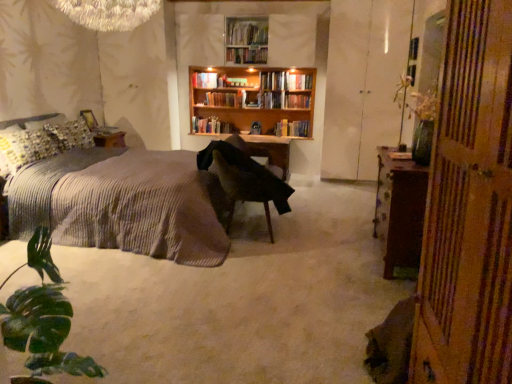
Question: Is hardcover book at center, acting as the 3th book starting from the bottom, smaller than hardcover books at center, the fifth book when ordered from top to bottom?

Choices:
 (A) no
 (B) yes

Answer: (B)

Question: From a real-world perspective, does hardcover book at center, acting as the 3th book starting from the bottom, sit lower than hardcover books at center, the fifth book when ordered from top to bottom?

Choices:
 (A) yes
 (B) no

Answer: (B)

Question: Considering the relative sizes of hardcover book at center, arranged as the 3th book when viewed from the top, and hardcover books at center, the 1th book when ordered from bottom to top, in the image provided, is hardcover book at center, arranged as the 3th book when viewed from the top, wider than hardcover books at center, the 1th book when ordered from bottom to top,?

Choices:
 (A) no
 (B) yes

Answer: (A)

Question: Considering the relative sizes of hardcover book at center, acting as the 3th book starting from the bottom, and hardcover books at center, the fifth book when ordered from top to bottom, in the image provided, is hardcover book at center, acting as the 3th book starting from the bottom, shorter than hardcover books at center, the fifth book when ordered from top to bottom,?

Choices:
 (A) yes
 (B) no

Answer: (A)

Question: Can you confirm if hardcover book at center, acting as the 3th book starting from the bottom, is bigger than hardcover books at center, the fifth book when ordered from top to bottom?

Choices:
 (A) yes
 (B) no

Answer: (B)

Question: Is hardcover book at center, acting as the 3th book starting from the bottom, far from hardcover books at center, the fifth book when ordered from top to bottom?

Choices:
 (A) no
 (B) yes

Answer: (B)

Question: Is white glossy cabinet at right positioned beyond the bounds of brown wooden cabinet at right?

Choices:
 (A) yes
 (B) no

Answer: (A)

Question: From a real-world perspective, is white glossy cabinet at right physically below brown wooden cabinet at right?

Choices:
 (A) no
 (B) yes

Answer: (A)

Question: Is white glossy cabinet at right positioned in front of brown wooden cabinet at right?

Choices:
 (A) no
 (B) yes

Answer: (A)

Question: Could you tell me if white glossy cabinet at right is facing brown wooden cabinet at right?

Choices:
 (A) yes
 (B) no

Answer: (A)

Question: Does white glossy cabinet at right appear on the left side of brown wooden cabinet at right?

Choices:
 (A) no
 (B) yes

Answer: (A)

Question: Is white glossy cabinet at right positioned with its back to brown wooden cabinet at right?

Choices:
 (A) yes
 (B) no

Answer: (B)

Question: Is hardcover book at center, marked as the 2th book in a top-to-bottom arrangement, oriented away from hardcover book at center, acting as the 3th book starting from the bottom?

Choices:
 (A) no
 (B) yes

Answer: (A)